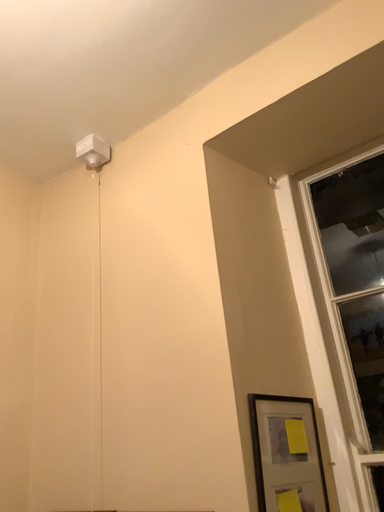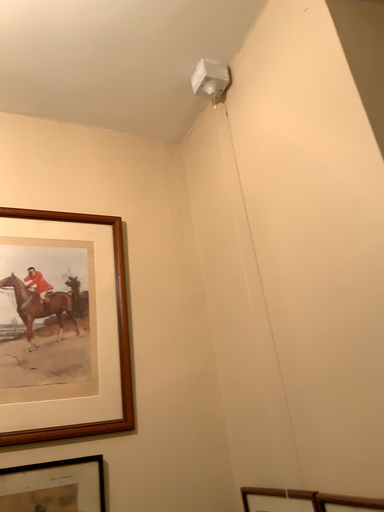
Question: Which way did the camera rotate in the video?

Choices:
 (A) rotated downward
 (B) rotated upward

Answer: (A)